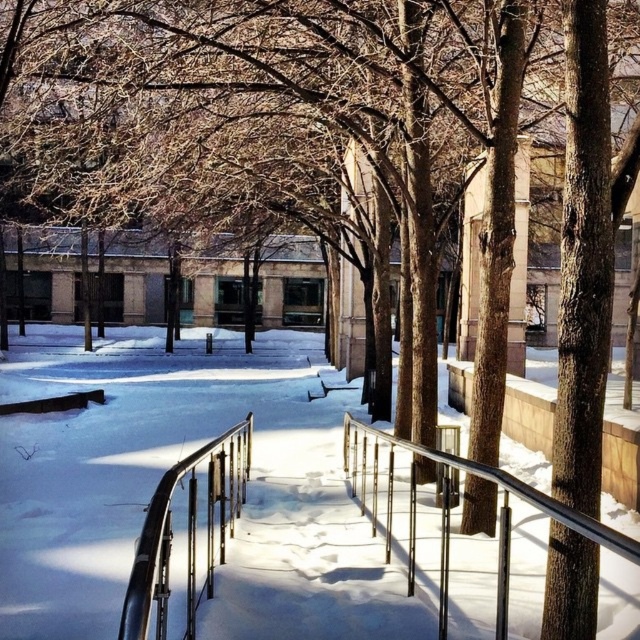
You are a snowplow operator needing to clear the snow between the white powdery snow at center and the black metal railing at center. The snowplow has a maximum reach of 9 meters. Can you clear the snow between them without moving the plow?

The distance between the white powdery snow at center and the black metal railing at center is 9.29 meters, which exceeds the snowplow operator maximum reach of 9 meters. Therefore, the snowplow cannot clear the snow between them without moving the plow.

You are standing at the entrance of the snow path and want to reach the black metal railing at center. According to the coordinates provided, where should you head to find it?

The black metal railing at center is located at coordinates point (186,538), so you should head towards that coordinate point to find it.

You are standing at the point marked as point [168,467] in the winter scene. What material is under your feet?

The material under your feet at point [168,467] is white powdery snow at center.